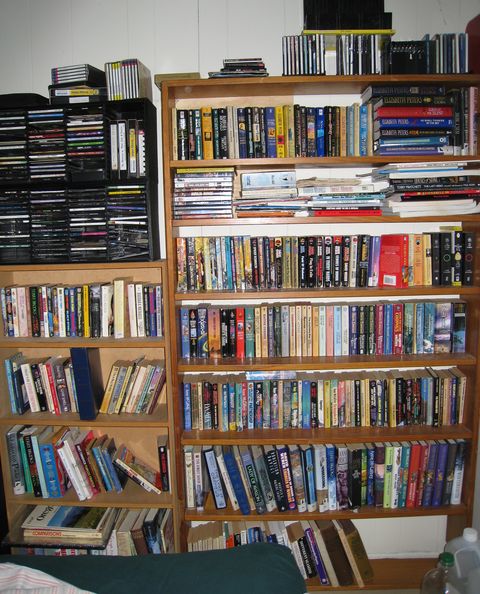
Locate an element on the screen. shelves of books is located at coordinates (98, 319), (116, 380), (127, 469), (128, 530), (334, 546), (329, 469), (339, 391), (337, 321), (291, 188), (289, 119).